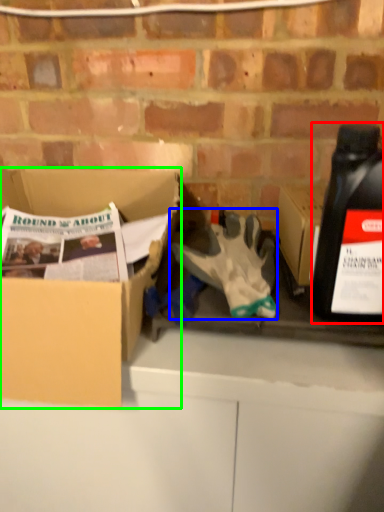
Question: Which is nearer to the bottle (highlighted by a red box)? glove (highlighted by a blue box) or box (highlighted by a green box).

Choices:
 (A) glove
 (B) box

Answer: (A)